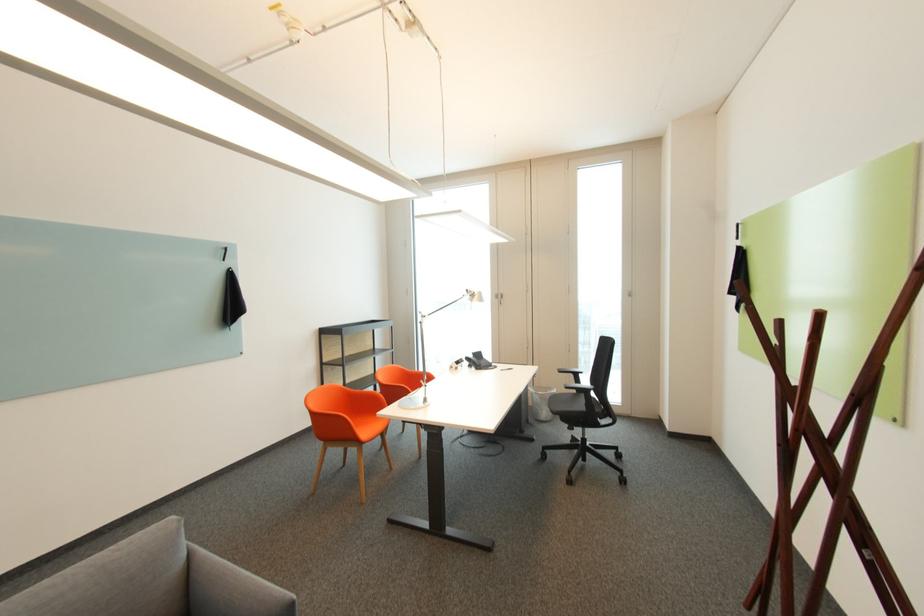
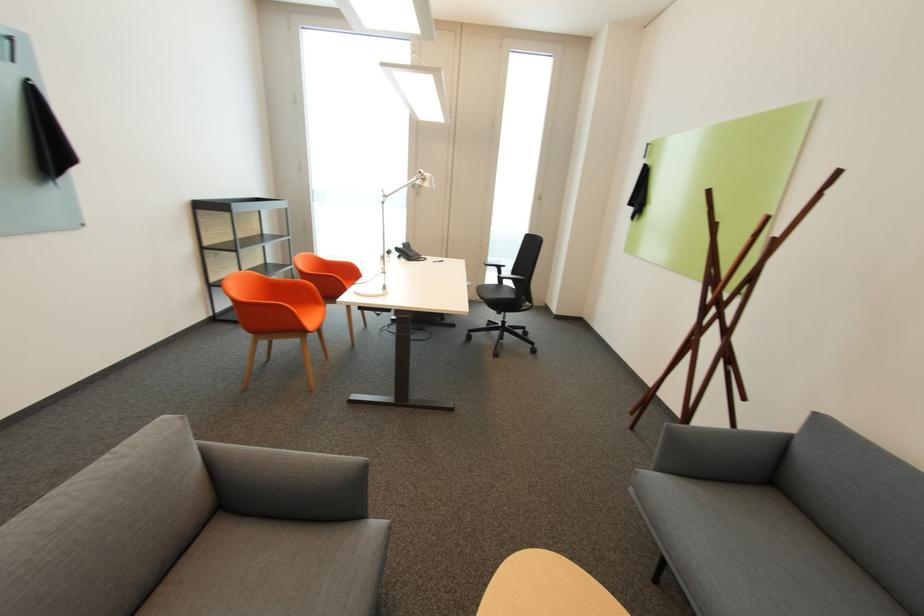
In the second image, find the point that corresponds to [388,386] in the first image.

(310, 275)